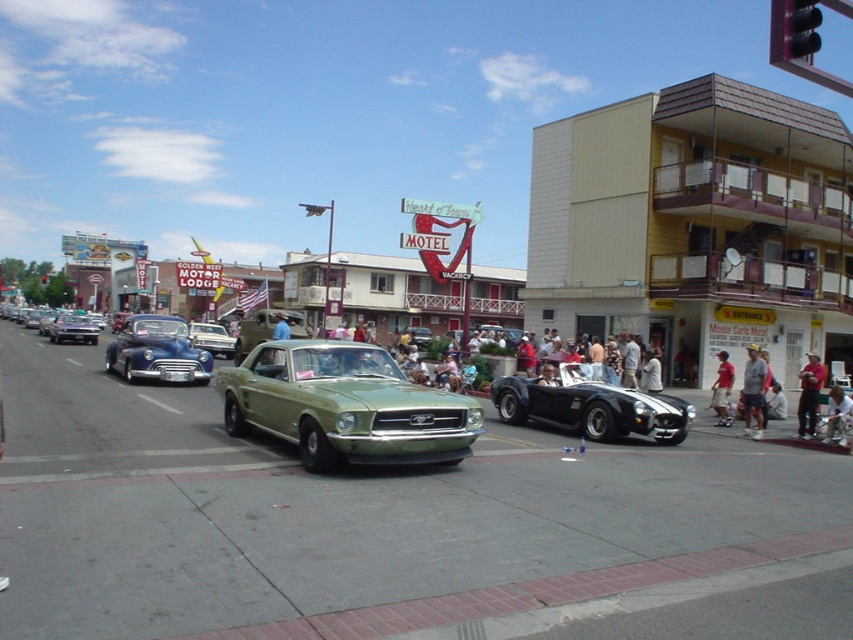
You are a pedestrian standing on the sidewalk and want to take a photo of both the black plastic traffic light at upper right and the shiny silver sedan at center. Which object should you adjust your camera angle to capture first if you want to include both in the frame?

The black plastic traffic light at upper right is shorter than the shiny silver sedan at center, so you should adjust your camera angle to capture the shiny silver sedan at center first, then angle upwards slightly to include the black plastic traffic light at upper right.

You are standing at the starting point of the car parade route and see two points marked on the map. The first point is labeled as point (793, 29) and the second point is labeled as point (202, 330). If you want to reach the second point, which direction should you move relative to the first point?

To reach point (202, 330) from point (793, 29), you should move to the right and downward since point (793, 29) is in front of point (202, 330).

You are a photographer trying to capture both the black plastic traffic light at upper right and the shiny silver sedan at center in a single frame. Based on their sizes in the image, which object would appear smaller?

The black plastic traffic light at upper right appears smaller because it has a lesser width compared to the shiny silver sedan at center.